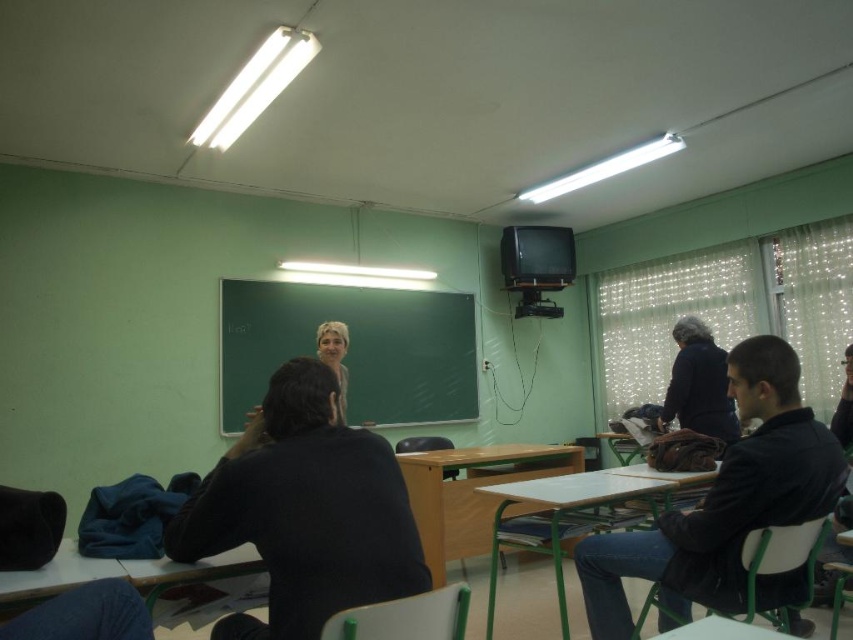
Question: Which point is closer to the camera taking this photo?

Choices:
 (A) (428, 464)
 (B) (672, 376)

Answer: (A)

Question: Which object is the farthest from the white wood table at lower right?

Choices:
 (A) black matte jacket at right
 (B) dark blue sweater at right
 (C) blonde hair at center

Answer: (C)

Question: Observing the image, what is the correct spatial positioning of black matte jacket at right in reference to dark blue sweater at right?

Choices:
 (A) below
 (B) above

Answer: (A)

Question: Which of the following is the farthest from the observer?

Choices:
 (A) (838, 476)
 (B) (502, 512)

Answer: (B)

Question: Is white wood table at lower right wider than dark blue sweater at right?

Choices:
 (A) no
 (B) yes

Answer: (B)

Question: Where is black matte shirt at center located in relation to black matte jacket at right in the image?

Choices:
 (A) right
 (B) left

Answer: (B)